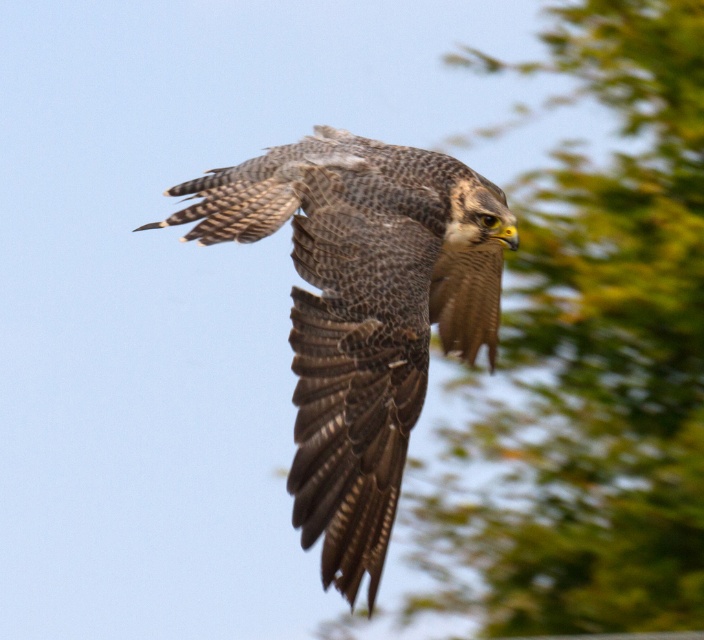
Can you confirm if green leafy tree at upper right is positioned to the left of speckled feathered falcon at center?

Incorrect, green leafy tree at upper right is not on the left side of speckled feathered falcon at center.

Can you confirm if green leafy tree at upper right is bigger than speckled feathered falcon at center?

Yes, green leafy tree at upper right is bigger than speckled feathered falcon at center.

Is point (693, 547) positioned behind point (458, 332)?

Yes, point (693, 547) is behind point (458, 332).

I want to click on green leafy tree at upper right, so click(593, 358).